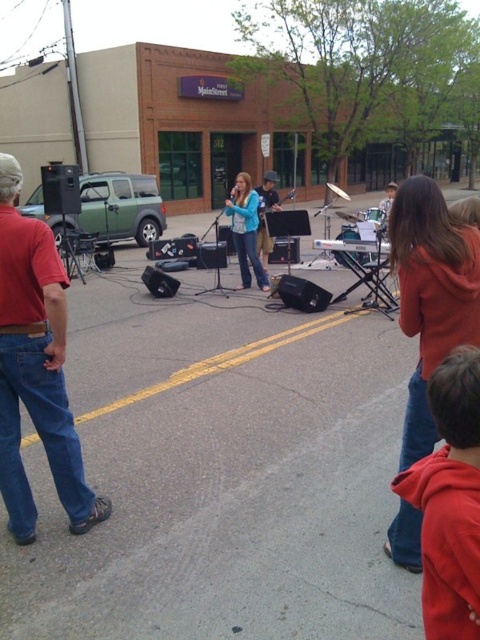
Question: Which point is farther from the camera taking this photo?

Choices:
 (A) (268, 250)
 (B) (78, 529)
 (C) (432, 524)

Answer: (A)

Question: Observing the image, what is the correct spatial positioning of orange hoodie at right in reference to blue denim jeans at center?

Choices:
 (A) below
 (B) above

Answer: (A)

Question: Among these objects, which one is farthest from the camera?

Choices:
 (A) red fleece jacket at lower right
 (B) blue denim jeans at center

Answer: (B)

Question: Which of these objects is positioned closest to the red fleece jacket at lower right?

Choices:
 (A) orange hoodie at right
 (B) matte red shirt at left
 (C) blue denim jacket at center

Answer: (A)

Question: Is orange hoodie at right further to the viewer compared to blue denim jacket at center?

Choices:
 (A) yes
 (B) no

Answer: (B)

Question: Is orange hoodie at right positioned before blue denim jacket at center?

Choices:
 (A) no
 (B) yes

Answer: (B)